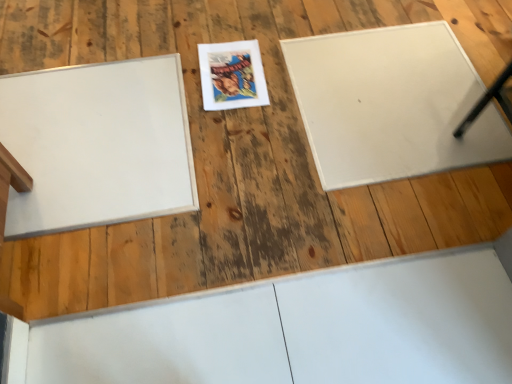
What are the coordinates of `free space above white matte board at upper right, which is the 2th bulletin board in left-to-right order (from a real-world perspective)` in the screenshot? It's located at click(387, 92).